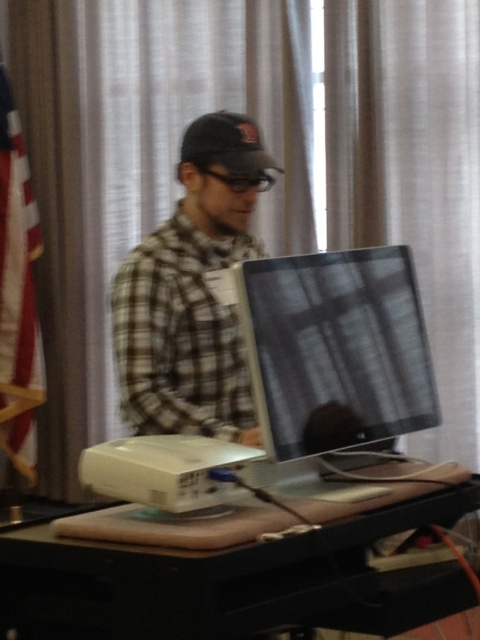
Question: Which point is closer to the camera taking this photo?

Choices:
 (A) (201, 120)
 (B) (271, 342)

Answer: (B)

Question: Considering the relative positions of plaid fabric shirt at center and red-white-blue fabric flag at left in the image provided, where is plaid fabric shirt at center located with respect to red-white-blue fabric flag at left?

Choices:
 (A) right
 (B) left

Answer: (A)

Question: Is matte black monitor at center bigger than plaid fabric shirt at center?

Choices:
 (A) no
 (B) yes

Answer: (A)

Question: Which object is the farthest from the plaid fabric shirt at center?

Choices:
 (A) black plastic projector at lower center
 (B) red-white-blue fabric flag at left

Answer: (B)

Question: Is black plastic projector at lower center bigger than dark gray matte baseball cap at center?

Choices:
 (A) no
 (B) yes

Answer: (B)

Question: Which object is farther from the camera taking this photo?

Choices:
 (A) matte black monitor at center
 (B) black plastic projector at lower center
 (C) red-white-blue fabric flag at left
 (D) dark gray matte baseball cap at center

Answer: (C)